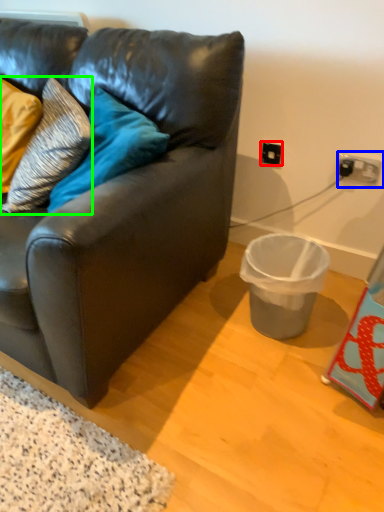
Question: Estimate the real-world distances between objects in this image. Which object is closer to electric outlet (highlighted by a red box), power outlet (highlighted by a blue box) or pillow (highlighted by a green box)?

Choices:
 (A) power outlet
 (B) pillow

Answer: (A)